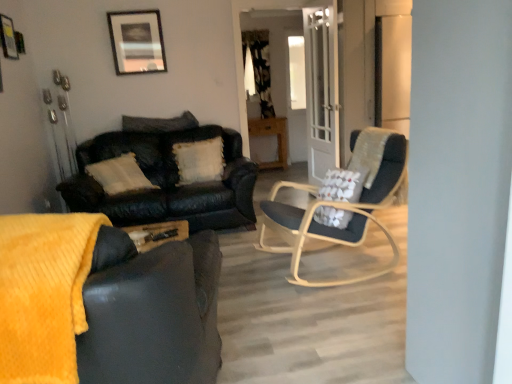
Question: Would you say clear glass door at center is to the left or to the right of white fluffy pillow at center, the second pillow in the top-to-bottom sequence, in the picture?

Choices:
 (A) left
 (B) right

Answer: (B)

Question: Is clear glass door at center in front of or behind white fluffy pillow at center, the second pillow in the top-to-bottom sequence, in the image?

Choices:
 (A) behind
 (B) front

Answer: (B)

Question: Which of these objects is positioned farthest from the clear glass door at center?

Choices:
 (A) wooden table at center
 (B) matte black picture frame at upper center
 (C) matte black couch at lower left, positioned as the 2th studio couch in back-to-front order
 (D) fluffy white pillow at center, marked as the 1th pillow in a top-to-bottom arrangement
 (E) leather couch at left, marked as the 2th studio couch in a front-to-back arrangement

Answer: (C)

Question: Estimate the real-world distances between objects in this image. Which object is farther from the matte black picture frame at upper center?

Choices:
 (A) white fluffy pillow at center, the second pillow in the top-to-bottom sequence
 (B) clear glass door at center
 (C) black textured curtain at upper center
 (D) wooden table at center
 (E) leather couch at left, acting as the first studio couch starting from the back

Answer: (D)